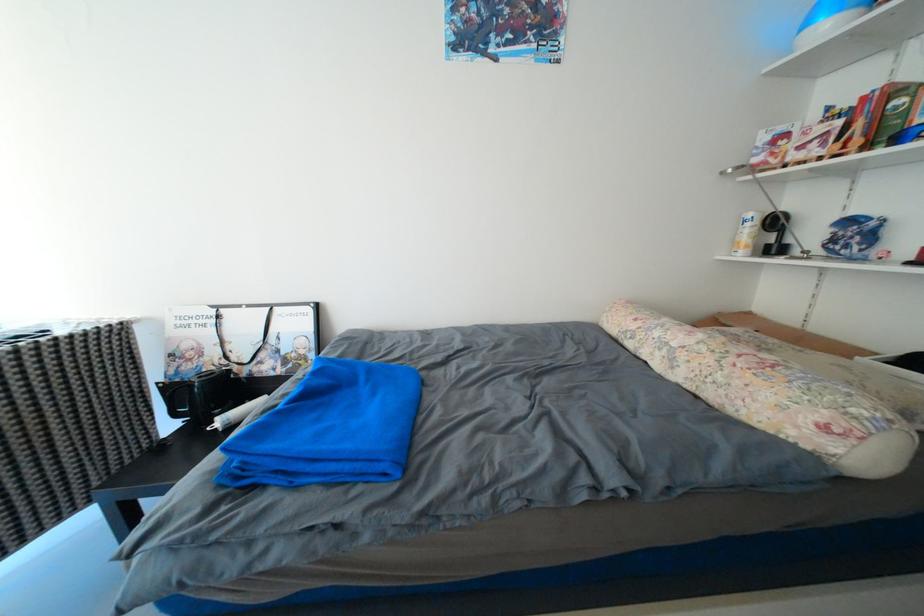
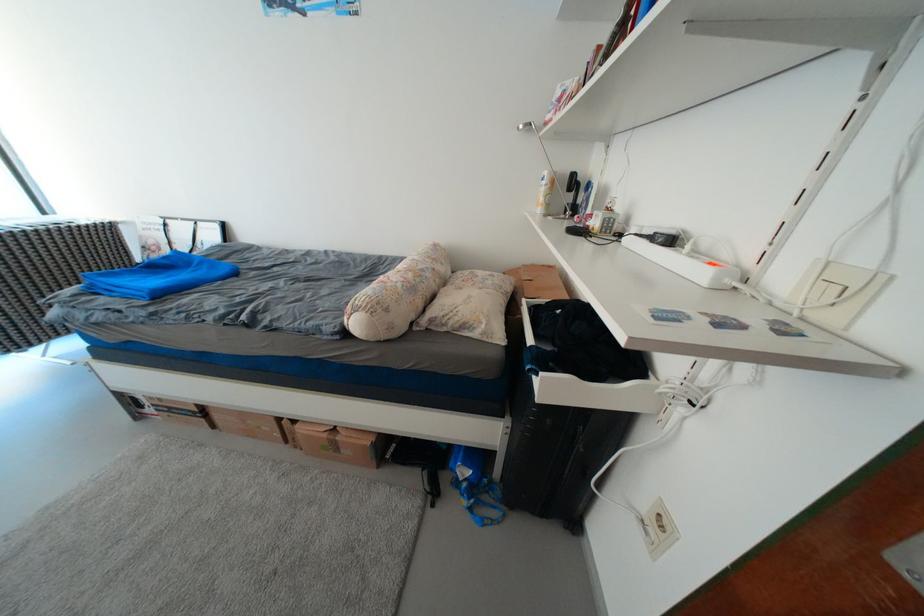
Locate, in the second image, the point that corresponds to point 197,369 in the first image.

(163, 257)